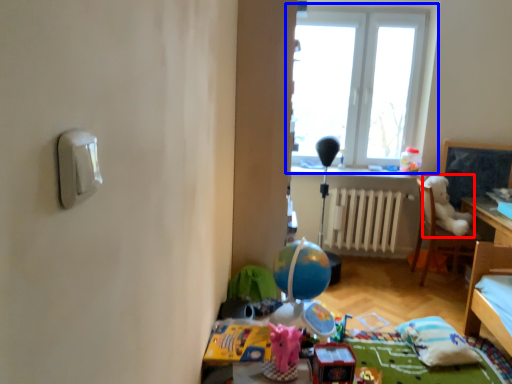
Question: Which object appears farthest to the camera in this image, animal (highlighted by a red box) or window (highlighted by a blue box)?

Choices:
 (A) animal
 (B) window

Answer: (B)